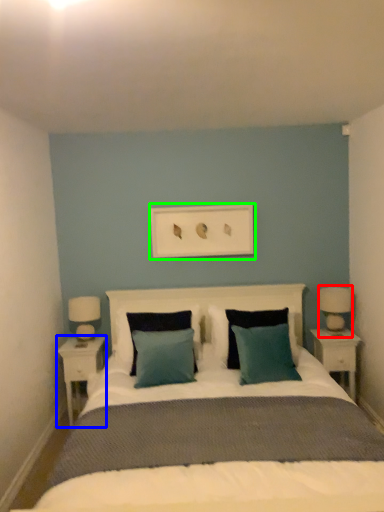
Question: Which is farther away from bedside lamp (highlighted by a red box)? nightstand (highlighted by a blue box) or picture frame (highlighted by a green box)?

Choices:
 (A) nightstand
 (B) picture frame

Answer: (A)